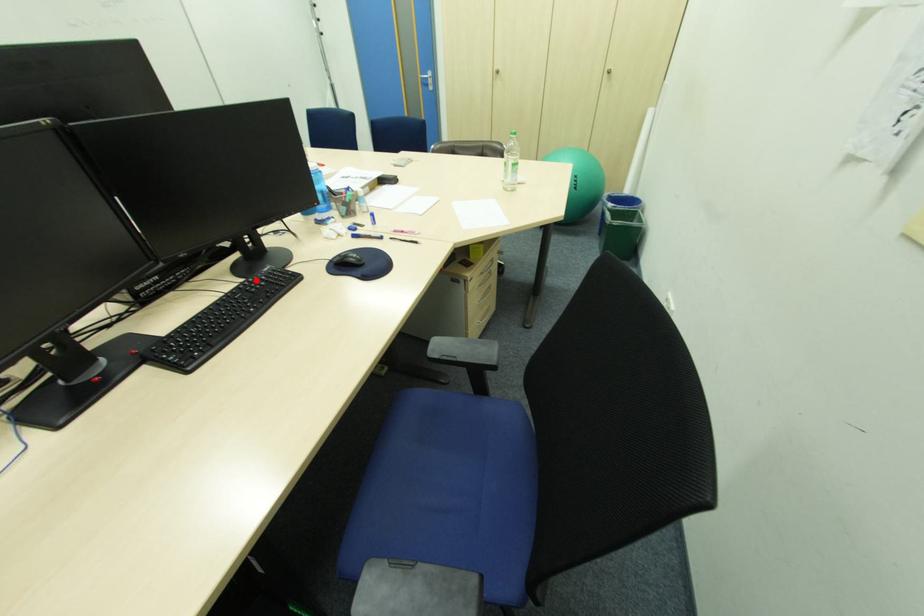
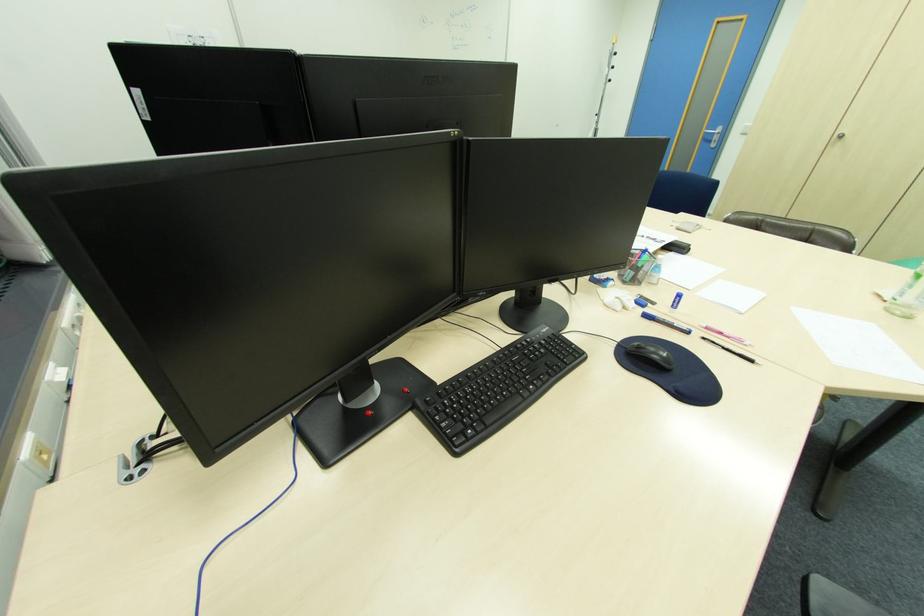
Question: I am providing you with two images of the same scene from different viewpoints. A red point is marked on the first image. Can you still see the location of the red point in image 2?

Choices:
 (A) Yes
 (B) No

Answer: (A)